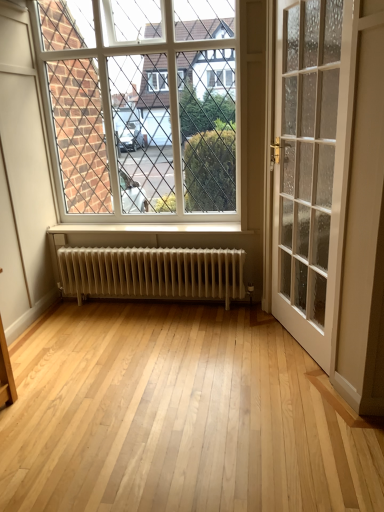
Question: Looking at the image, does white glass door at right seem bigger or smaller compared to white metallic radiator at center?

Choices:
 (A) big
 (B) small

Answer: (A)

Question: Would you say white glass door at right is inside or outside white metallic radiator at center?

Choices:
 (A) inside
 (B) outside

Answer: (B)

Question: Which object is positioned farthest from the white glass window at upper center?

Choices:
 (A) white metallic radiator at center
 (B) white glass door at right

Answer: (B)

Question: Which of these objects is positioned closest to the white glass window at upper center?

Choices:
 (A) white glass door at right
 (B) white metallic radiator at center

Answer: (B)